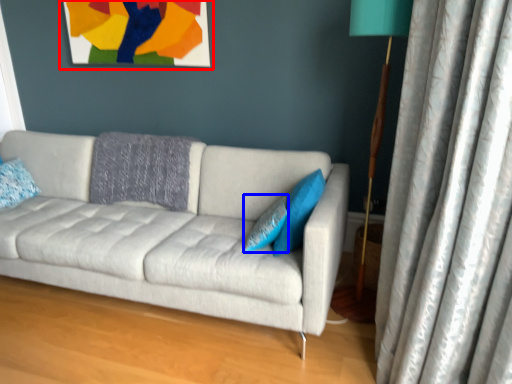
Question: Which of the following is the closest to the observer, picture frame (highlighted by a red box) or pillow (highlighted by a blue box)?

Choices:
 (A) picture frame
 (B) pillow

Answer: (B)